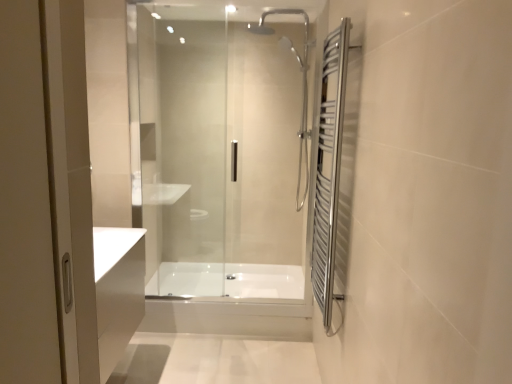
Question: Considering the positions of polished chrome towel rack at right and transparent glass shower door at center in the image, is polished chrome towel rack at right taller or shorter than transparent glass shower door at center?

Choices:
 (A) short
 (B) tall

Answer: (A)

Question: Is polished chrome towel rack at right to the left or to the right of transparent glass shower door at center in the image?

Choices:
 (A) left
 (B) right

Answer: (B)

Question: Estimate the real-world distances between objects in this image. Which object is farther from the white glossy bathtub at center, which appears as the second bath when viewed from the front?

Choices:
 (A) polished chrome towel rack at right
 (B) white glossy bathtub at center, acting as the second bath starting from the back
 (C) transparent glass shower door at center

Answer: (A)

Question: Based on their relative distances, which object is farther from the white glossy bathtub at center, the 1th bath viewed from the back?

Choices:
 (A) white glossy bathtub at center, acting as the second bath starting from the back
 (B) polished chrome towel rack at right
 (C) transparent glass shower door at center

Answer: (B)